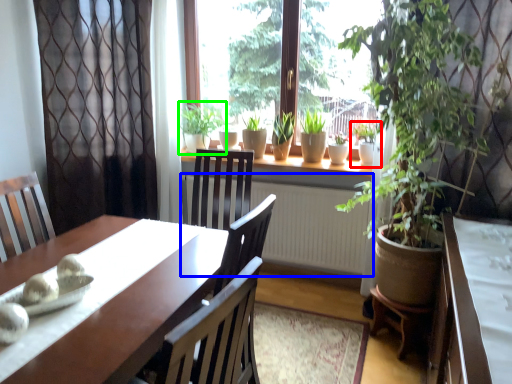
Question: Based on their relative distances, which object is nearer to houseplant (highlighted by a red box)? Choose from radiator (highlighted by a blue box) and houseplant (highlighted by a green box).

Choices:
 (A) radiator
 (B) houseplant

Answer: (A)